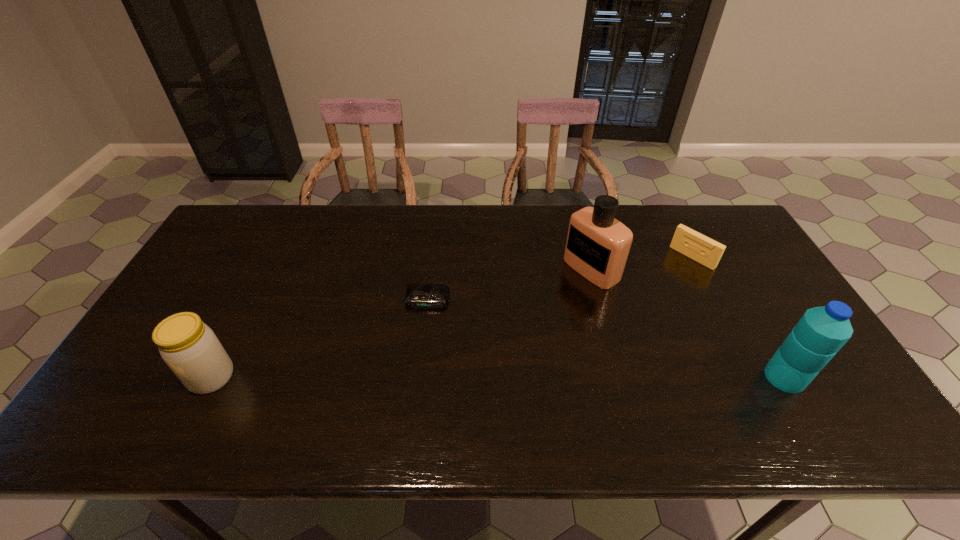
Where is `water bottle that is at the near edge`? This screenshot has width=960, height=540. water bottle that is at the near edge is located at coordinates (821, 332).

The width and height of the screenshot is (960, 540). In order to click on water bottle present at the right edge in this screenshot , I will do `click(821, 332)`.

The height and width of the screenshot is (540, 960). Find the location of `videotape that is at the right edge`. videotape that is at the right edge is located at coordinates (706, 251).

What are the coordinates of `object positioned at the far right corner` in the screenshot? It's located at (706, 251).

Where is `object positioned at the near right corner`? The height and width of the screenshot is (540, 960). object positioned at the near right corner is located at coordinates (821, 332).

Image resolution: width=960 pixels, height=540 pixels. Find the location of `vacant area at the far edge`. vacant area at the far edge is located at coordinates (390, 214).

In order to click on free space at the near edge in this screenshot , I will do 418,380.

In the image, there is a desktop. Where is `free region at the left edge`? free region at the left edge is located at coordinates (202, 271).

The image size is (960, 540). In order to click on vacant space at the right edge in this screenshot , I will do (x=739, y=299).

Identify the location of free space at the far left corner. (242, 222).